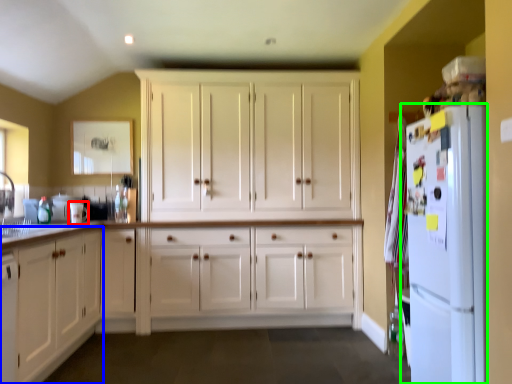
Question: Considering the real-world distances, which object is farthest from appliance (highlighted by a red box)? cabinetry (highlighted by a blue box) or refrigerator (highlighted by a green box)?

Choices:
 (A) cabinetry
 (B) refrigerator

Answer: (B)